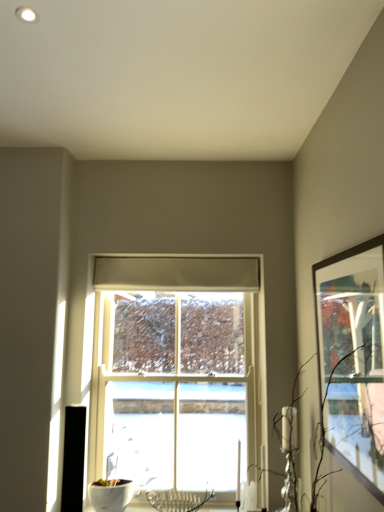
Question: Considering the relative positions of brown matte branch at right and matte black picture frame at right in the image provided, is brown matte branch at right to the left or to the right of matte black picture frame at right?

Choices:
 (A) right
 (B) left

Answer: (B)

Question: Is brown matte branch at right wider or thinner than matte black picture frame at right?

Choices:
 (A) thin
 (B) wide

Answer: (B)

Question: Which object is positioned closest to the white wooden window at center?

Choices:
 (A) matte black picture frame at right
 (B) brown matte branch at right

Answer: (B)

Question: Which of these objects is positioned closest to the matte black picture frame at right?

Choices:
 (A) brown matte branch at right
 (B) white wooden window at center

Answer: (A)